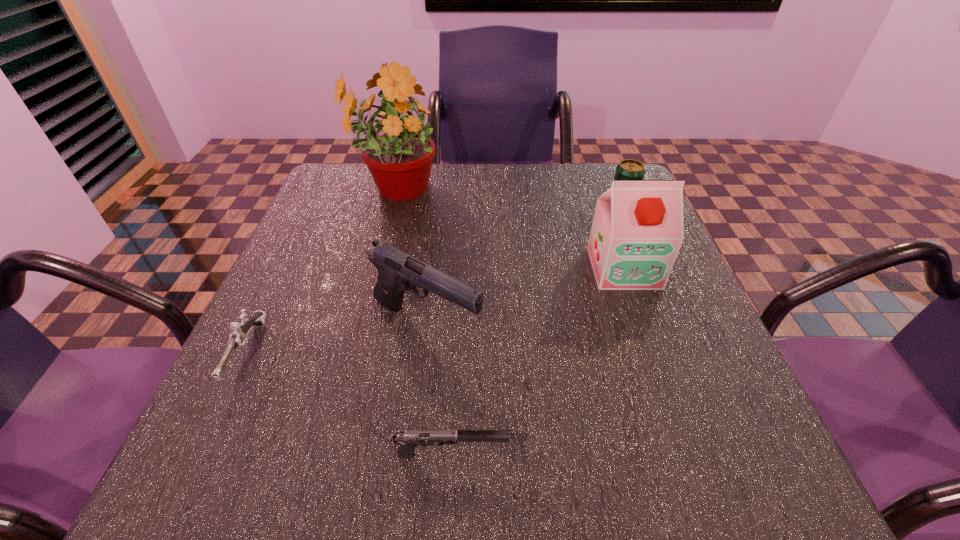
Identify the location of unoccupied position between the flowerpot and the fifth shortest object. (509, 228).

In order to click on vacant area between the leftmost gun and the soya milk in this screenshot , I will do `click(435, 310)`.

You are a GUI agent. You are given a task and a screenshot of the screen. Output one action in this format:
    pyautogui.click(x=<x>, y=<y>)
    Task: Click on the free space between the second tallest object and the tallest object
    
    Given the screenshot: What is the action you would take?
    tap(509, 228)

You are a GUI agent. You are given a task and a screenshot of the screen. Output one action in this format:
    pyautogui.click(x=<x>, y=<y>)
    Task: Click on the vacant space that's between the second tallest object and the leftmost gun
    
    Given the screenshot: What is the action you would take?
    coord(435,310)

I want to click on vacant area that lies between the beer can and the tallest gun, so click(x=524, y=264).

Identify the location of free space between the nearest object and the flowerpot. (422, 321).

Locate an element on the screen. Image resolution: width=960 pixels, height=540 pixels. object identified as the second closest to the leftmost gun is located at coordinates tap(407, 440).

Where is `object that is the second closest one to the nearest object`? The image size is (960, 540). object that is the second closest one to the nearest object is located at coordinates (238, 337).

This screenshot has width=960, height=540. Find the location of `gun that is the second closest one to the nearest gun`. gun that is the second closest one to the nearest gun is located at coordinates (238, 337).

Choose which gun is the second nearest neighbor to the leftmost object. Please provide its 2D coordinates. Your answer should be formatted as a tuple, i.e. [(x, y)], where the tuple contains the x and y coordinates of a point satisfying the conditions above.

[(407, 440)]